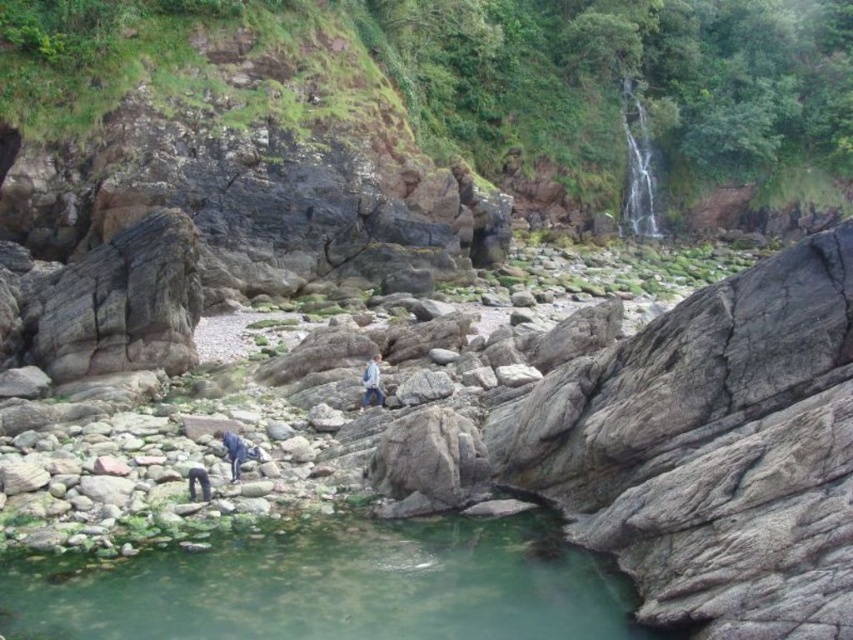
Question: Is blue denim pants at lower left wider than dark blue fabric person at lower left?

Choices:
 (A) no
 (B) yes

Answer: (B)

Question: Does light blue denim jacket at center appear on the right side of dark blue fabric person at lower left?

Choices:
 (A) no
 (B) yes

Answer: (B)

Question: Among these points, which one is farthest from the camera?

Choices:
 (A) (323, 579)
 (B) (230, 433)
 (C) (370, 372)

Answer: (C)

Question: Among these points, which one is nearest to the camera?

Choices:
 (A) (222, 445)
 (B) (207, 497)
 (C) (379, 387)

Answer: (B)

Question: Does green translucent water at lower center appear over light blue denim jacket at center?

Choices:
 (A) yes
 (B) no

Answer: (B)

Question: Which point appears farthest from the camera in this image?

Choices:
 (A) (512, 547)
 (B) (207, 481)
 (C) (381, 401)

Answer: (C)